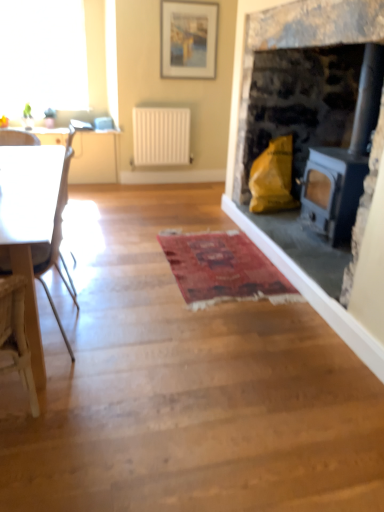
Question: Is white glossy countertop at upper left facing towards white matte radiator at center?

Choices:
 (A) yes
 (B) no

Answer: (B)

Question: Considering the relative sizes of white glossy countertop at upper left and white matte radiator at center in the image provided, is white glossy countertop at upper left thinner than white matte radiator at center?

Choices:
 (A) no
 (B) yes

Answer: (A)

Question: Does white glossy countertop at upper left have a lesser height compared to white matte radiator at center?

Choices:
 (A) no
 (B) yes

Answer: (B)

Question: Can you confirm if white glossy countertop at upper left is bigger than white matte radiator at center?

Choices:
 (A) no
 (B) yes

Answer: (A)

Question: From a real-world perspective, is white glossy countertop at upper left over white matte radiator at center?

Choices:
 (A) no
 (B) yes

Answer: (B)

Question: Considering the relative positions of white plastic chair at left and white matte radiator at center in the image provided, is white plastic chair at left to the left or to the right of white matte radiator at center?

Choices:
 (A) right
 (B) left

Answer: (B)

Question: Considering the positions of point (64, 165) and point (140, 111), is point (64, 165) closer or farther from the camera than point (140, 111)?

Choices:
 (A) closer
 (B) farther

Answer: (A)

Question: Choose the correct answer: Is white plastic chair at left inside white matte radiator at center or outside it?

Choices:
 (A) inside
 (B) outside

Answer: (B)

Question: From the image's perspective, is white plastic chair at left above or below white matte radiator at center?

Choices:
 (A) above
 (B) below

Answer: (B)

Question: In terms of size, does transparent glass window at upper left appear bigger or smaller than white glossy table at left?

Choices:
 (A) big
 (B) small

Answer: (A)

Question: From a real-world perspective, is transparent glass window at upper left physically located above or below white glossy table at left?

Choices:
 (A) below
 (B) above

Answer: (B)

Question: Considering the positions of transparent glass window at upper left and white glossy table at left in the image, is transparent glass window at upper left wider or thinner than white glossy table at left?

Choices:
 (A) thin
 (B) wide

Answer: (A)

Question: Considering the positions of point (3, 15) and point (105, 134), is point (3, 15) closer or farther from the camera than point (105, 134)?

Choices:
 (A) farther
 (B) closer

Answer: (A)

Question: Is white glossy table at left taller or shorter than white matte radiator at center?

Choices:
 (A) short
 (B) tall

Answer: (A)

Question: Considering their positions, is white glossy table at left located in front of or behind white matte radiator at center?

Choices:
 (A) behind
 (B) front

Answer: (B)